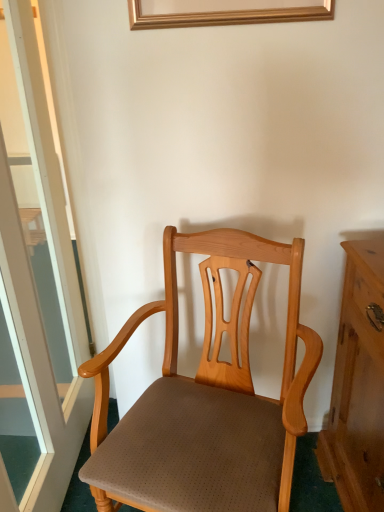
Question: From the image's perspective, is transparent glass door at left beneath light brown wood chair at center?

Choices:
 (A) yes
 (B) no

Answer: (B)

Question: Is transparent glass door at left with light brown wood chair at center?

Choices:
 (A) yes
 (B) no

Answer: (B)

Question: Is transparent glass door at left thinner than light brown wood chair at center?

Choices:
 (A) yes
 (B) no

Answer: (A)

Question: From a real-world perspective, is transparent glass door at left located higher than light brown wood chair at center?

Choices:
 (A) no
 (B) yes

Answer: (B)

Question: From a real-world perspective, is transparent glass door at left under light brown wood chair at center?

Choices:
 (A) yes
 (B) no

Answer: (B)

Question: Considering the relative sizes of transparent glass door at left and light brown wood chair at center in the image provided, is transparent glass door at left bigger than light brown wood chair at center?

Choices:
 (A) no
 (B) yes

Answer: (A)

Question: Considering the relative positions of light brown wood chair at center and transparent glass door at left in the image provided, is light brown wood chair at center to the left of transparent glass door at left from the viewer's perspective?

Choices:
 (A) no
 (B) yes

Answer: (A)

Question: Does light brown wood chair at center lie in front of transparent glass door at left?

Choices:
 (A) no
 (B) yes

Answer: (A)

Question: Considering the relative sizes of light brown wood chair at center and transparent glass door at left in the image provided, is light brown wood chair at center shorter than transparent glass door at left?

Choices:
 (A) no
 (B) yes

Answer: (B)

Question: From the image's perspective, is light brown wood chair at center located above transparent glass door at left?

Choices:
 (A) no
 (B) yes

Answer: (A)

Question: Considering the relative sizes of light brown wood chair at center and transparent glass door at left in the image provided, is light brown wood chair at center thinner than transparent glass door at left?

Choices:
 (A) yes
 (B) no

Answer: (B)

Question: Is light brown wood chair at center with transparent glass door at left?

Choices:
 (A) no
 (B) yes

Answer: (A)

Question: From a real-world perspective, is transparent glass door at left physically located above or below light brown wood chair at center?

Choices:
 (A) above
 (B) below

Answer: (A)